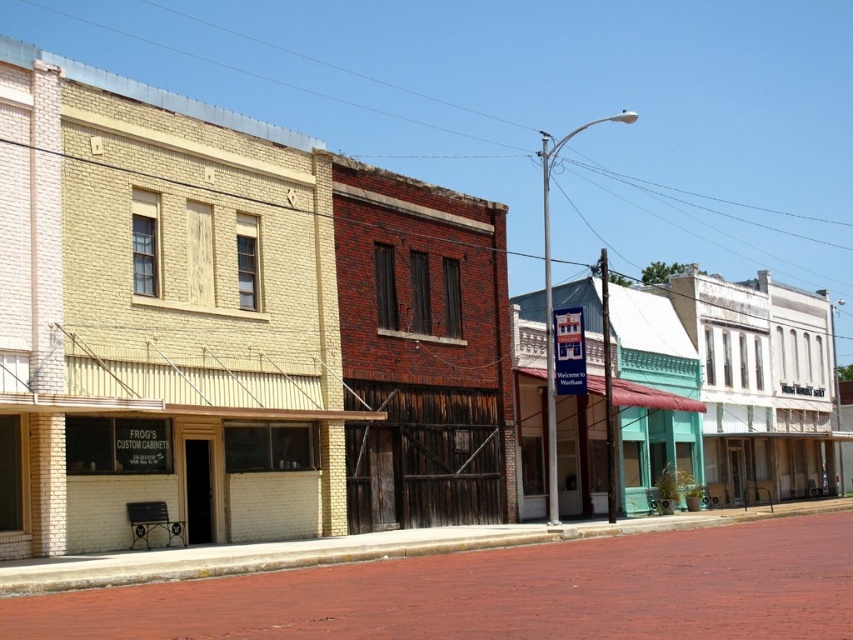
Question: Which of the following is the farthest from the observer?

Choices:
 (A) green painted wood storefront at center
 (B) white wooden storefront at center

Answer: (B)

Question: Which object is farther from the camera taking this photo?

Choices:
 (A) white wooden storefront at center
 (B) green painted wood storefront at center

Answer: (A)

Question: Which point is closer to the camera?

Choices:
 (A) white wooden storefront at center
 (B) green painted wood storefront at center

Answer: (B)

Question: Can you confirm if white wooden storefront at center is positioned above green painted wood storefront at center?

Choices:
 (A) no
 (B) yes

Answer: (A)

Question: Can you confirm if white wooden storefront at center is positioned to the left of green painted wood storefront at center?

Choices:
 (A) no
 (B) yes

Answer: (A)

Question: In this image, where is white wooden storefront at center located relative to green painted wood storefront at center?

Choices:
 (A) left
 (B) right

Answer: (B)